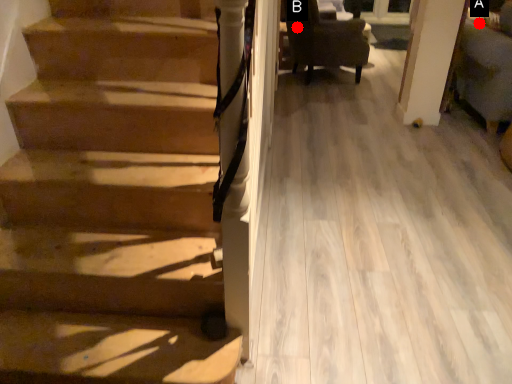
Question: Two points are circled on the image, labeled by A and B beside each circle. Which point is closer to the camera taking this photo?

Choices:
 (A) A is closer
 (B) B is closer

Answer: (B)